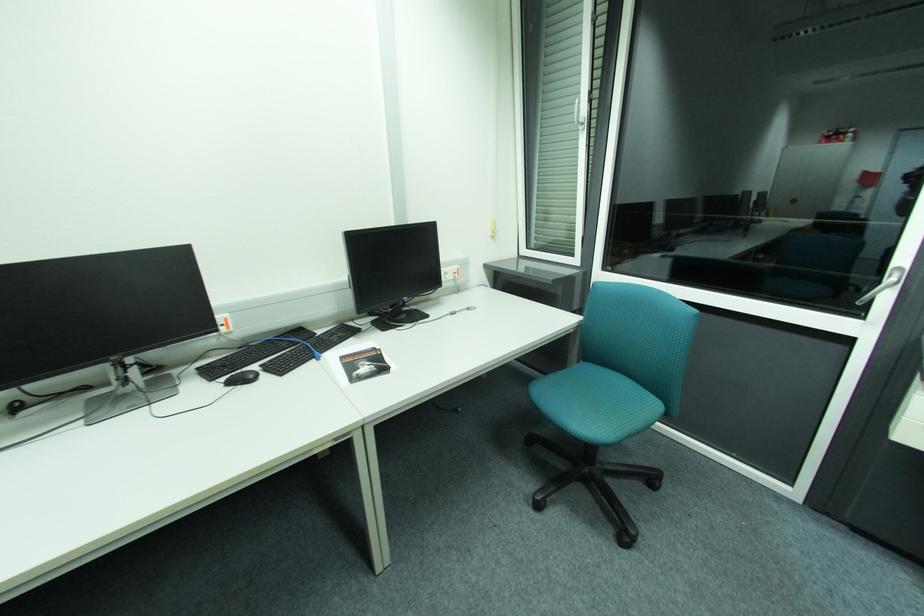
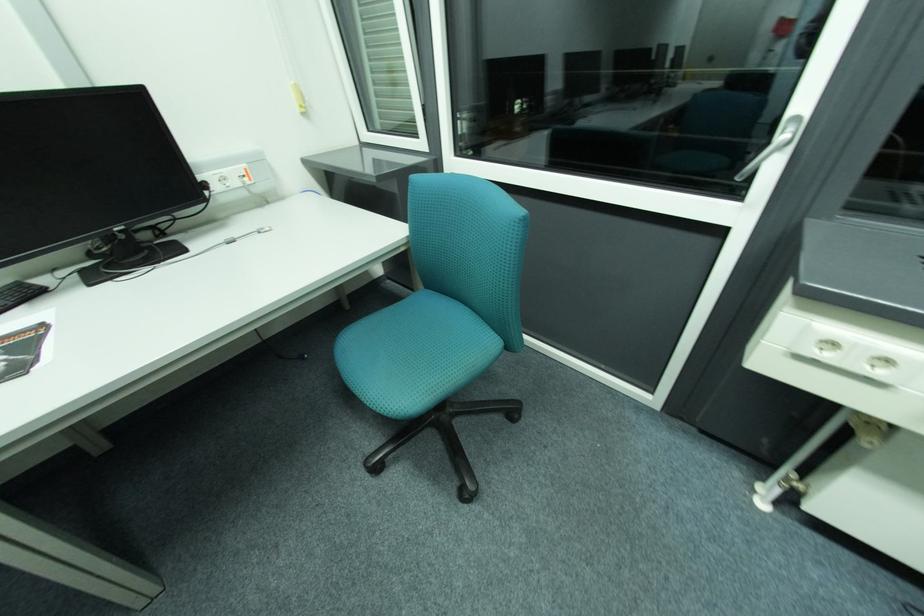
Question: Based on the continuous images, in which direction is the camera rotating? Reply with the corresponding letter.

Choices:
 (A) Left
 (B) Right
 (C) Up
 (D) Down

Answer: (D)